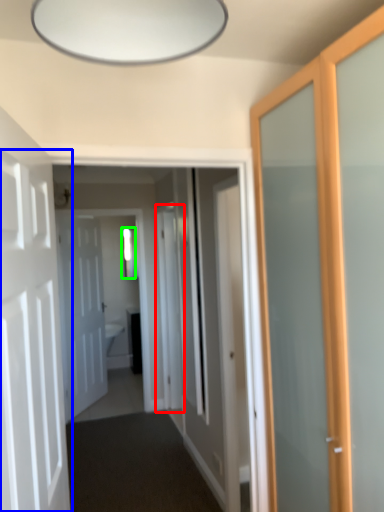
Question: Estimate the real-world distances between objects in this image. Which object is closer to screen door (highlighted by a red box), door (highlighted by a blue box) or window (highlighted by a green box)?

Choices:
 (A) door
 (B) window

Answer: (B)